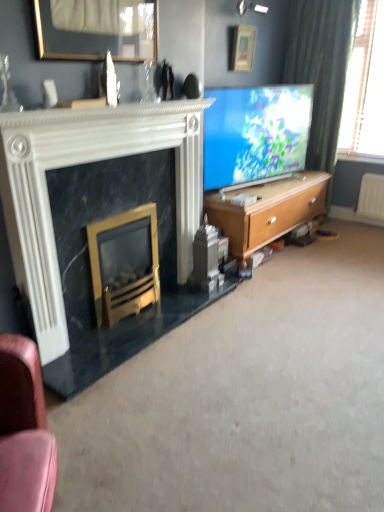
Question: Considering the relative positions of gold metallic fireplace at lower left, which is the second fireplace from top to bottom, and white marble fireplace at left, acting as the 1th fireplace starting from the top, in the image provided, is gold metallic fireplace at lower left, which is the second fireplace from top to bottom, to the left of white marble fireplace at left, acting as the 1th fireplace starting from the top, from the viewer's perspective?

Choices:
 (A) yes
 (B) no

Answer: (A)

Question: Does gold metallic fireplace at lower left, which is the second fireplace from top to bottom, have a greater height compared to white marble fireplace at left, acting as the 1th fireplace starting from the top?

Choices:
 (A) yes
 (B) no

Answer: (B)

Question: Considering the relative positions of gold metallic fireplace at lower left, the first fireplace when ordered from bottom to top, and white marble fireplace at left, acting as the 1th fireplace starting from the top, in the image provided, is gold metallic fireplace at lower left, the first fireplace when ordered from bottom to top, in front of white marble fireplace at left, acting as the 1th fireplace starting from the top,?

Choices:
 (A) no
 (B) yes

Answer: (A)

Question: Is gold metallic fireplace at lower left, the first fireplace when ordered from bottom to top, positioned with its back to white marble fireplace at left, which is the 2th fireplace in bottom-to-top order?

Choices:
 (A) no
 (B) yes

Answer: (A)

Question: Is gold metallic fireplace at lower left, the first fireplace when ordered from bottom to top, bigger than white marble fireplace at left, acting as the 1th fireplace starting from the top?

Choices:
 (A) no
 (B) yes

Answer: (A)

Question: Considering the positions of wooden picture frame at upper center, the second picture frame when ordered from top to bottom, and wooden cabinet at right in the image, is wooden picture frame at upper center, the second picture frame when ordered from top to bottom, wider or thinner than wooden cabinet at right?

Choices:
 (A) thin
 (B) wide

Answer: (A)

Question: Is wooden picture frame at upper center, the second picture frame when ordered from top to bottom, to the left or to the right of wooden cabinet at right in the image?

Choices:
 (A) right
 (B) left

Answer: (B)

Question: Is wooden picture frame at upper center, placed as the first picture frame when sorted from front to back, in front of or behind wooden cabinet at right in the image?

Choices:
 (A) behind
 (B) front

Answer: (B)

Question: Considering the positions of wooden picture frame at upper center, the second picture frame when ordered from top to bottom, and wooden cabinet at right in the image, is wooden picture frame at upper center, the second picture frame when ordered from top to bottom, taller or shorter than wooden cabinet at right?

Choices:
 (A) tall
 (B) short

Answer: (B)

Question: From a real-world perspective, relative to matte white picture frame at upper center, the second picture frame when ordered from bottom to top, is matte blue screen at center vertically above or below?

Choices:
 (A) above
 (B) below

Answer: (B)

Question: From the image's perspective, is matte blue screen at center located above or below matte white picture frame at upper center, the first picture frame when ordered from top to bottom?

Choices:
 (A) above
 (B) below

Answer: (B)

Question: Considering the positions of matte blue screen at center and matte white picture frame at upper center, which is the 2th picture frame in left-to-right order, in the image, is matte blue screen at center bigger or smaller than matte white picture frame at upper center, which is the 2th picture frame in left-to-right order,?

Choices:
 (A) small
 (B) big

Answer: (B)

Question: Visually, is matte blue screen at center positioned to the left or to the right of matte white picture frame at upper center, which is the 2th picture frame in left-to-right order?

Choices:
 (A) right
 (B) left

Answer: (A)

Question: Relative to white marble fireplace at left, which is the 2th fireplace in bottom-to-top order, is matte white picture frame at upper center, the second picture frame when ordered from bottom to top, in front or behind?

Choices:
 (A) front
 (B) behind

Answer: (B)

Question: Is point (251, 48) positioned closer to the camera than point (180, 117)?

Choices:
 (A) farther
 (B) closer

Answer: (A)